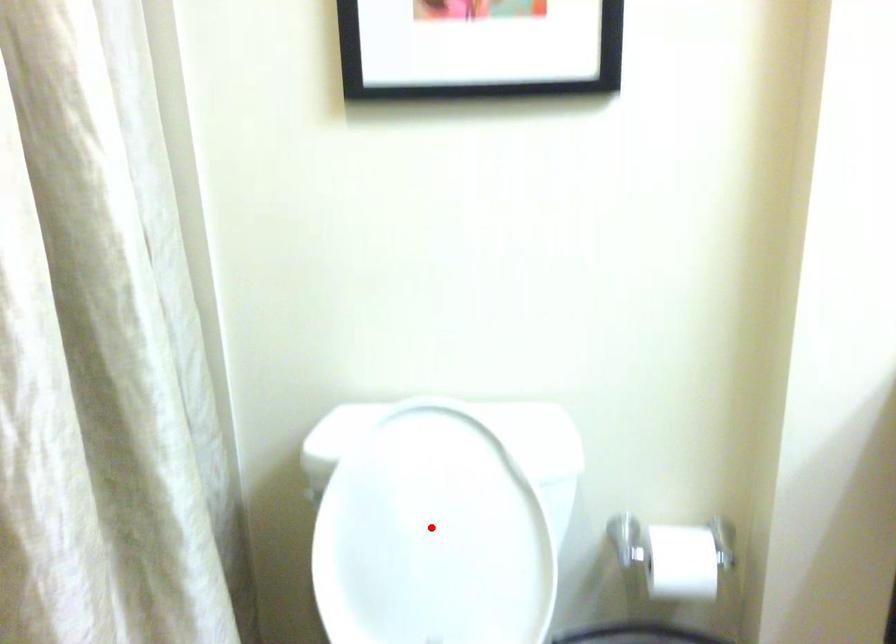
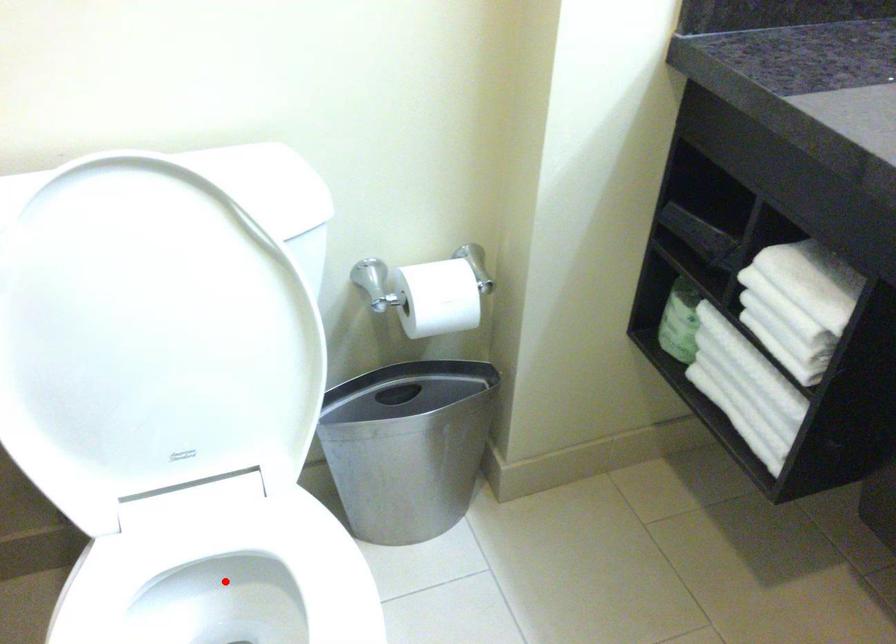
I am providing you with two images of the same scene from different viewpoints. A red point is marked on the first image and another point is marked on the second image. Are the points marked in image1 and image2 representing the same 3D position?

No